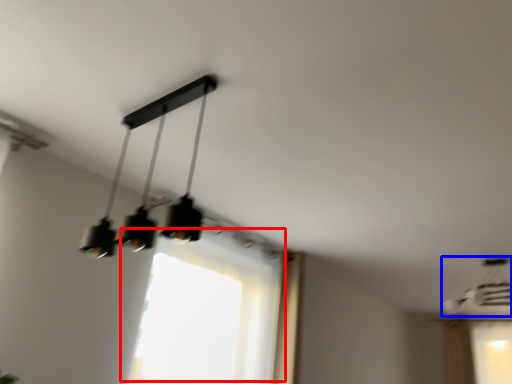
Question: Which object is closer to the camera taking this photo, window (highlighted by a red box) or lamp (highlighted by a blue box)?

Choices:
 (A) window
 (B) lamp

Answer: (A)